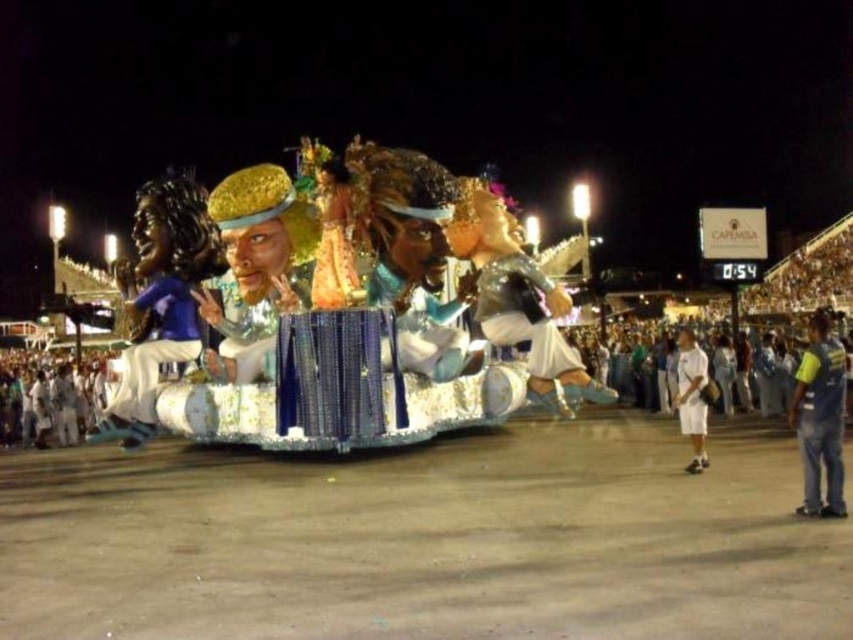
You are a photographer at the carnival parade. You want to take a photo of the blue jeans at lower right. Where should you point your camera?

You should point your camera to the lower right at point (820, 417) to capture the blue jeans at lower right.

You are a photographer at the carnival parade. You want to capture a photo that includes both the shiny silver costume at center and the matte blue fabric at left. Given that your camera has a maximum focus range of 35 meters, will you be able to include both in the same frame without moving closer?

The shiny silver costume at center and the matte blue fabric at left are 36.64 meters apart. Since your camera can only focus up to 35 meters, you will not be able to capture both in the same frame without moving closer.

You are a photographer standing at the edge of the carnival parade. You want to take a photo that includes both the blue jeans at lower right and the white fabric costume at lower right. Given that your camera has a maximum zoom range of 10 meters, will you be able to capture both subjects in a single frame without moving closer?

The blue jeans at lower right and white fabric costume at lower right are 14.06 meters apart. Since your camera can only zoom up to 10 meters, it won want be able to capture both subjects in a single frame without moving closer.